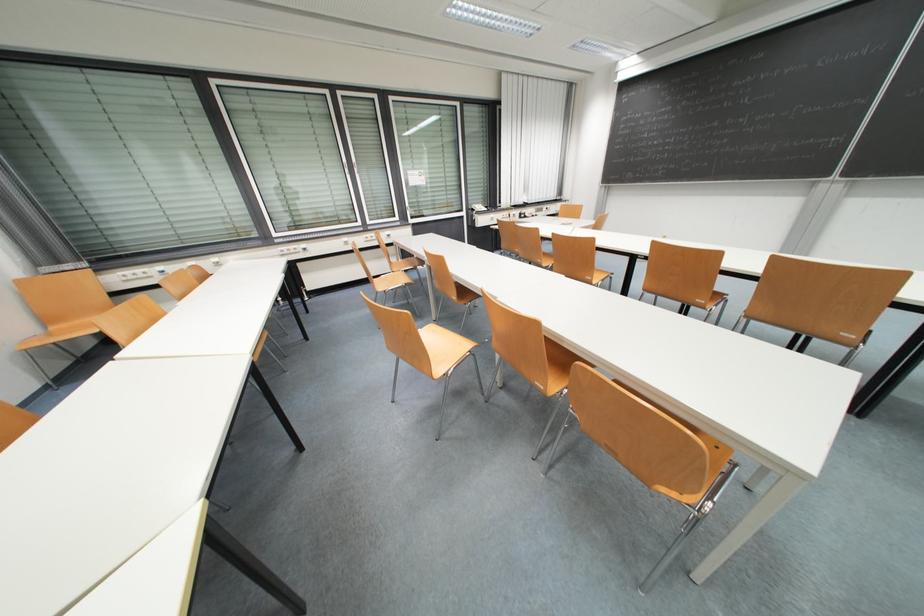
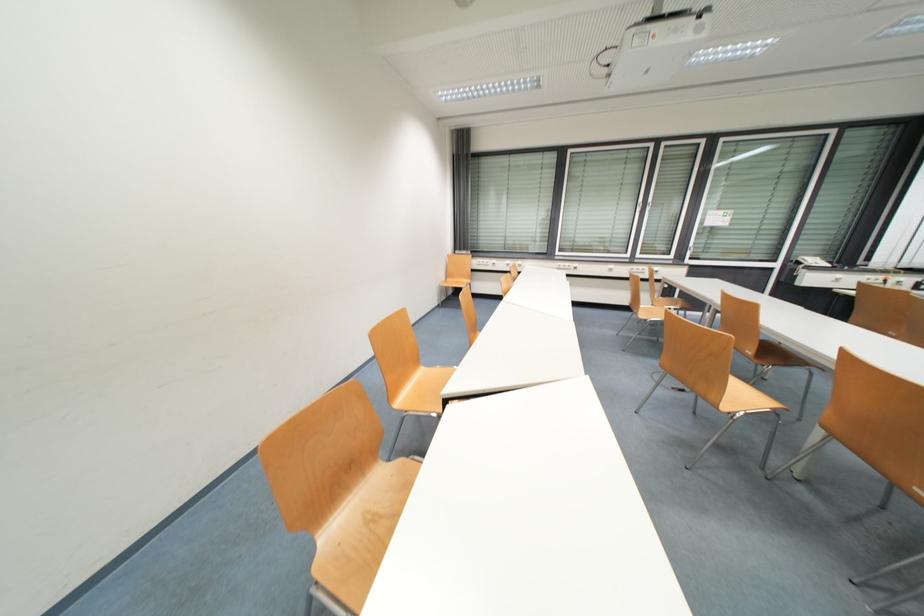
Question: The first image is from the beginning of the video and the second image is from the end. How did the camera likely rotate when shooting the video?

Choices:
 (A) Left
 (B) Right
 (C) Up
 (D) Down

Answer: (A)